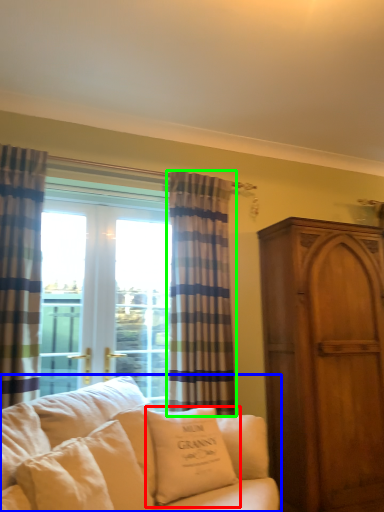
Question: Considering the real-world distances, which object is farthest from pillow (highlighted by a red box)? studio couch (highlighted by a blue box) or curtain (highlighted by a green box)?

Choices:
 (A) studio couch
 (B) curtain

Answer: (B)